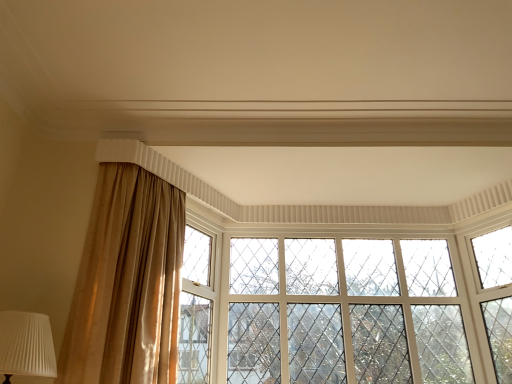
Question: Is point (196, 251) closer or farther from the camera than point (35, 369)?

Choices:
 (A) farther
 (B) closer

Answer: (A)

Question: From a real-world perspective, is clear glass window at center physically located above or below white pleated fabric at lower left?

Choices:
 (A) below
 (B) above

Answer: (B)

Question: Which of these objects is positioned farthest from the white textured glass window frame at center?

Choices:
 (A) white pleated fabric at lower left
 (B) clear glass window at center
 (C) satin beige curtain at left

Answer: (A)

Question: Estimate the real-world distances between objects in this image. Which object is closer to the clear glass window at center?

Choices:
 (A) satin beige curtain at left
 (B) white pleated fabric at lower left
 (C) white textured glass window frame at center

Answer: (C)